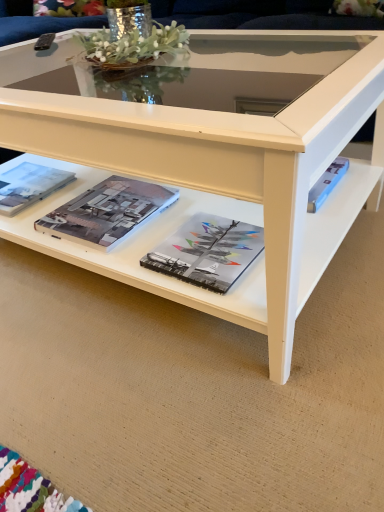
Question: Should I look upward or downward to see matte paper magazine at center, the second magazine from the left?

Choices:
 (A) down
 (B) up

Answer: (B)

Question: Is white glossy coffee table at center further to camera compared to matte paper magazine at center, the second magazine from the left?

Choices:
 (A) yes
 (B) no

Answer: (B)

Question: Are white glossy coffee table at center and matte paper magazine at center, placed as the 2th magazine when sorted from right to left, far apart?

Choices:
 (A) yes
 (B) no

Answer: (B)

Question: Is white glossy coffee table at center thinner than matte paper magazine at center, placed as the 2th magazine when sorted from right to left?

Choices:
 (A) yes
 (B) no

Answer: (B)

Question: From a real-world perspective, is white glossy coffee table at center positioned under matte paper magazine at center, placed as the 2th magazine when sorted from right to left, based on gravity?

Choices:
 (A) yes
 (B) no

Answer: (B)

Question: Is white glossy coffee table at center taller than matte paper magazine at center, the second magazine from the left?

Choices:
 (A) yes
 (B) no

Answer: (A)

Question: Is white glossy coffee table at center aimed at matte paper magazine at center, the second magazine from the left?

Choices:
 (A) yes
 (B) no

Answer: (A)

Question: From the image's perspective, is matte hardcover book at center, positioned as the 3th magazine in left-to-right order, located beneath matte paper magazine at left, the first magazine positioned from the left?

Choices:
 (A) no
 (B) yes

Answer: (B)

Question: Are matte hardcover book at center, the first magazine in the right-to-left sequence, and matte paper magazine at left, acting as the 3th magazine starting from the right, located far from each other?

Choices:
 (A) yes
 (B) no

Answer: (B)

Question: Does matte hardcover book at center, the first magazine in the right-to-left sequence, touch matte paper magazine at left, the first magazine positioned from the left?

Choices:
 (A) no
 (B) yes

Answer: (A)

Question: Is matte hardcover book at center, positioned as the 3th magazine in left-to-right order, to the left of matte paper magazine at left, acting as the 3th magazine starting from the right, from the viewer's perspective?

Choices:
 (A) yes
 (B) no

Answer: (B)

Question: Considering the relative sizes of matte hardcover book at center, the first magazine in the right-to-left sequence, and matte paper magazine at left, acting as the 3th magazine starting from the right, in the image provided, is matte hardcover book at center, the first magazine in the right-to-left sequence, smaller than matte paper magazine at left, acting as the 3th magazine starting from the right,?

Choices:
 (A) yes
 (B) no

Answer: (A)

Question: Is matte hardcover book at center, positioned as the 3th magazine in left-to-right order, oriented away from matte paper magazine at left, acting as the 3th magazine starting from the right?

Choices:
 (A) no
 (B) yes

Answer: (A)

Question: From a real-world perspective, is matte hardcover book at center, the first magazine in the right-to-left sequence, located beneath matte paper magazine at center, placed as the 2th magazine when sorted from right to left?

Choices:
 (A) yes
 (B) no

Answer: (A)